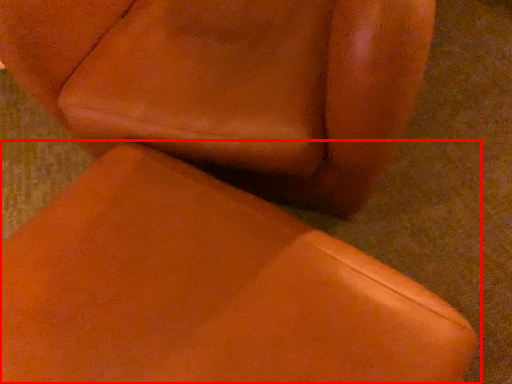
Question: From the image's perspective, where is chair (annotated by the red box) located relative to chair?

Choices:
 (A) below
 (B) above

Answer: (A)